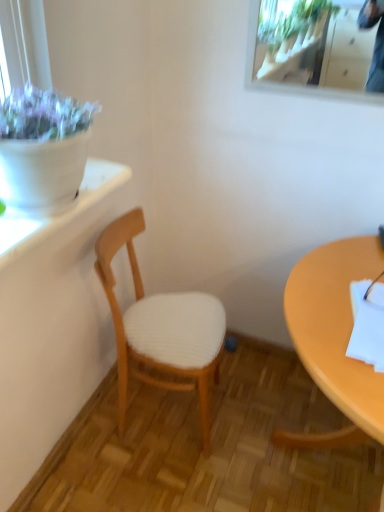
You are a GUI agent. You are given a task and a screenshot of the screen. Output one action in this format:
    pyautogui.click(x=<x>, y=<y>)
    Task: Click on the free region under matte yellow desk at right (from a real-world perspective)
    
    Given the screenshot: What is the action you would take?
    pyautogui.click(x=315, y=451)